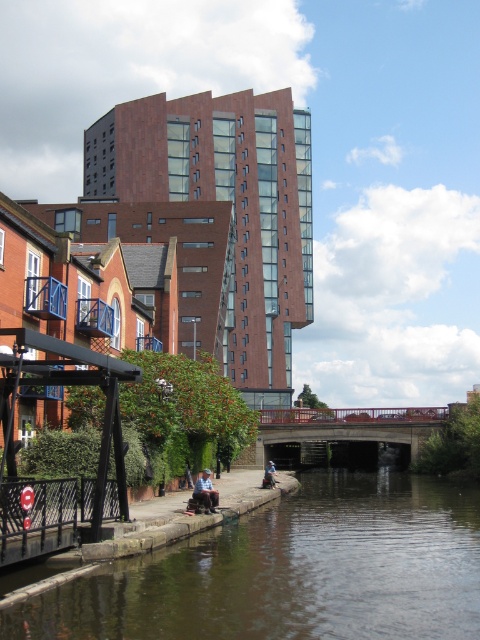
Does blue denim jeans at lower center have a lesser height compared to denim jacket at lower center?

Correct, blue denim jeans at lower center is not as tall as denim jacket at lower center.

Is point (202, 500) farther from camera compared to point (269, 465)?

No, it is in front of (269, 465).

Is point (205, 499) farther from viewer compared to point (268, 476)?

No, (205, 499) is in front of (268, 476).

Find the location of a particular element. blue denim jeans at lower center is located at coordinates (205, 492).

Is brown stone river at lower center below blue denim jeans at lower center?

A: Correct, brown stone river at lower center is located below blue denim jeans at lower center.

Does point (456, 582) lie in front of point (215, 490)?

Yes, it is in front of point (215, 490).

You are a GUI agent. You are given a task and a screenshot of the screen. Output one action in this format:
    pyautogui.click(x=<x>, y=<y>)
    Task: Click on the brown stone river at lower center
    The width and height of the screenshot is (480, 640).
    Given the screenshot: What is the action you would take?
    pyautogui.click(x=292, y=570)

Where is `brown stone river at lower center`? The width and height of the screenshot is (480, 640). brown stone river at lower center is located at coordinates (292, 570).

Who is positioned more to the left, brown stone river at lower center or denim jacket at lower center?

Positioned to the left is denim jacket at lower center.

Measure the distance between brown stone river at lower center and camera.

A distance of 22.91 meters exists between brown stone river at lower center and camera.

Find the location of a particular element. The width and height of the screenshot is (480, 640). brown stone river at lower center is located at coordinates pos(292,570).